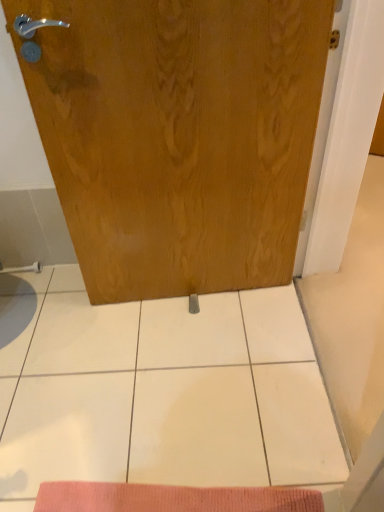
Where is `space that is in front of wooden door at center`? This screenshot has height=512, width=384. space that is in front of wooden door at center is located at coordinates tap(194, 383).